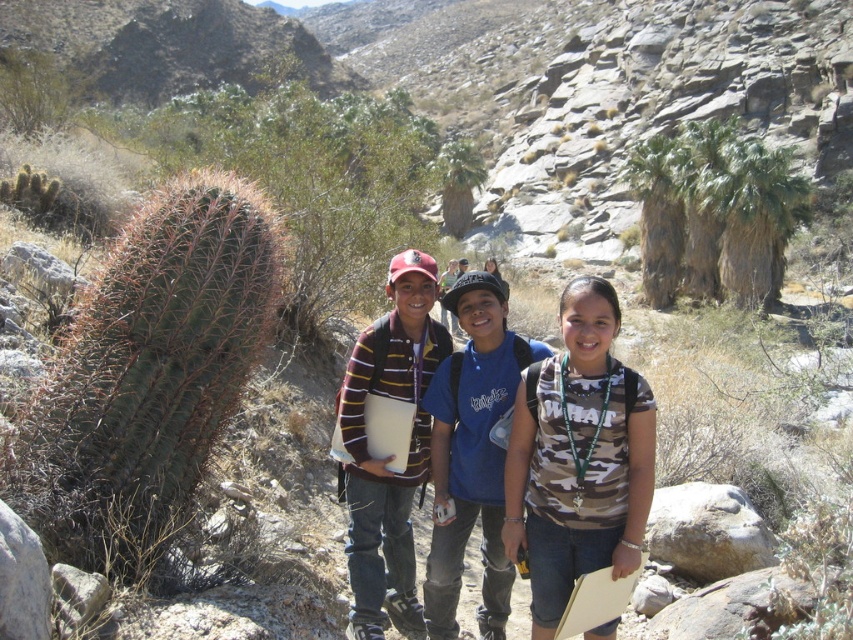
Is the position of camo fabric shirt at center more distant than that of striped wool sweater at center?

No, camo fabric shirt at center is closer to the viewer.

Where is `camo fabric shirt at center`? camo fabric shirt at center is located at coordinates (578, 458).

Who is taller, camouflage fabric shirt at center or blue cotton shirt at center?

camouflage fabric shirt at center

Is camouflage fabric shirt at center in front of blue cotton shirt at center?

Yes.

You are a GUI agent. You are given a task and a screenshot of the screen. Output one action in this format:
    pyautogui.click(x=<x>, y=<y>)
    Task: Click on the camouflage fabric shirt at center
    The height and width of the screenshot is (640, 853).
    Given the screenshot: What is the action you would take?
    pyautogui.click(x=430, y=440)

The image size is (853, 640). I want to click on camouflage fabric shirt at center, so click(430, 440).

Is point (579, 477) positioned after point (459, 312)?

No, (579, 477) is in front of (459, 312).

Can you confirm if camo fabric shirt at center is bigger than blue cotton shirt at center?

Actually, camo fabric shirt at center might be smaller than blue cotton shirt at center.

Does point (509, 536) come closer to viewer compared to point (437, 611)?

Yes, point (509, 536) is closer to viewer.

Where is `camo fabric shirt at center`? This screenshot has width=853, height=640. camo fabric shirt at center is located at coordinates (578, 458).